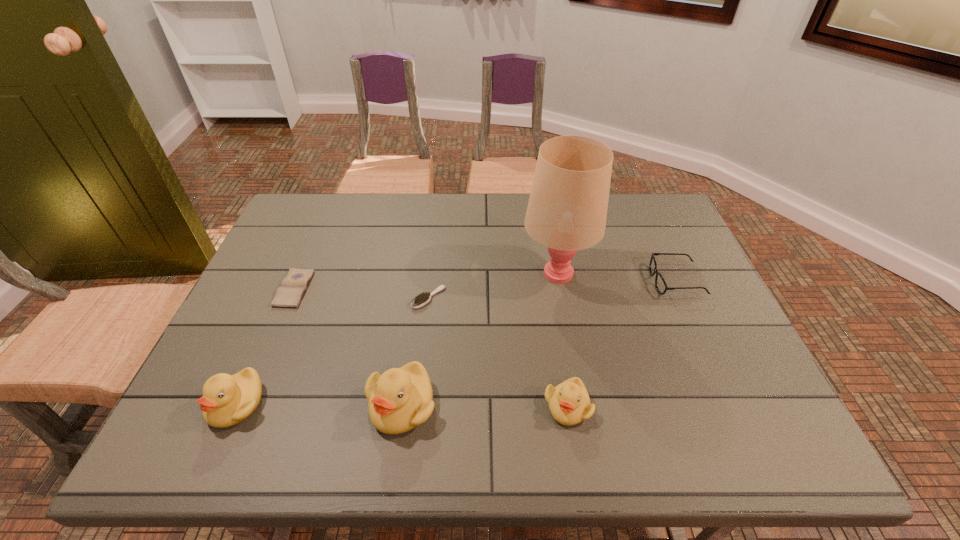
I want to click on object located in the near left corner section of the desktop, so click(x=227, y=400).

Where is `vacant space at the far edge of the desktop`? vacant space at the far edge of the desktop is located at coordinates (477, 195).

Identify the location of vacant space at the near edge. Image resolution: width=960 pixels, height=540 pixels. (509, 383).

The image size is (960, 540). Identify the location of free location at the left edge of the desktop. (264, 329).

You are a GUI agent. You are given a task and a screenshot of the screen. Output one action in this format:
    pyautogui.click(x=<x>, y=<y>)
    Task: Click on the vacant space at the right edge
    The image size is (960, 540).
    Given the screenshot: What is the action you would take?
    pyautogui.click(x=678, y=284)

Where is `vacant space at the far left corner of the desktop`? vacant space at the far left corner of the desktop is located at coordinates (346, 193).

Find the location of a particular element. vacant space at the far right corner is located at coordinates (666, 225).

Where is `vacant area at the near right corner of the desktop`? The width and height of the screenshot is (960, 540). vacant area at the near right corner of the desktop is located at coordinates (761, 388).

In order to click on free space between the scrubbing brush and the tallest object in this screenshot , I will do `click(492, 286)`.

I want to click on blank region between the leftmost duckling and the tallest duckling, so click(319, 404).